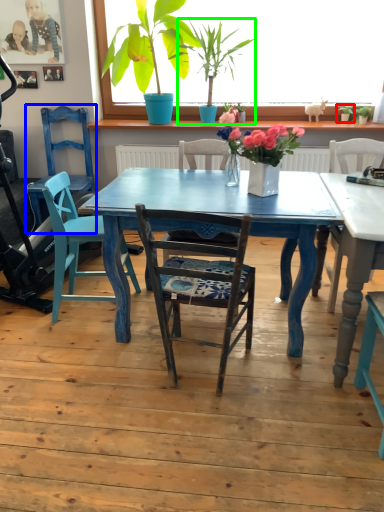
Question: Considering the real-world distances, which object is closest to houseplant (highlighted by a red box)? armchair (highlighted by a blue box) or houseplant (highlighted by a green box).

Choices:
 (A) armchair
 (B) houseplant

Answer: (B)